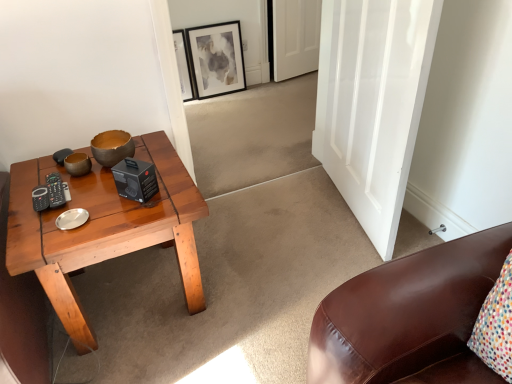
Find the location of `free point below matte black picture frame at upper center (from a real-world perspective)`. free point below matte black picture frame at upper center (from a real-world perspective) is located at coordinates (226, 94).